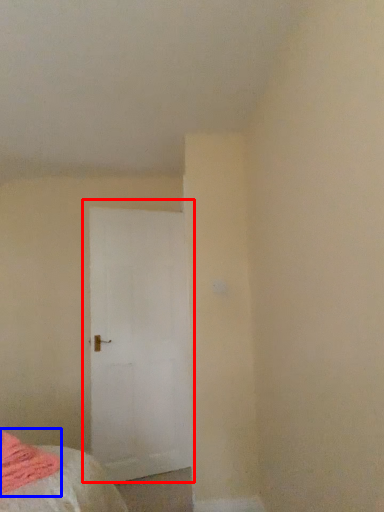
Question: Which object appears farthest to the camera in this image, door (highlighted by a red box) or blanket (highlighted by a blue box)?

Choices:
 (A) door
 (B) blanket

Answer: (A)